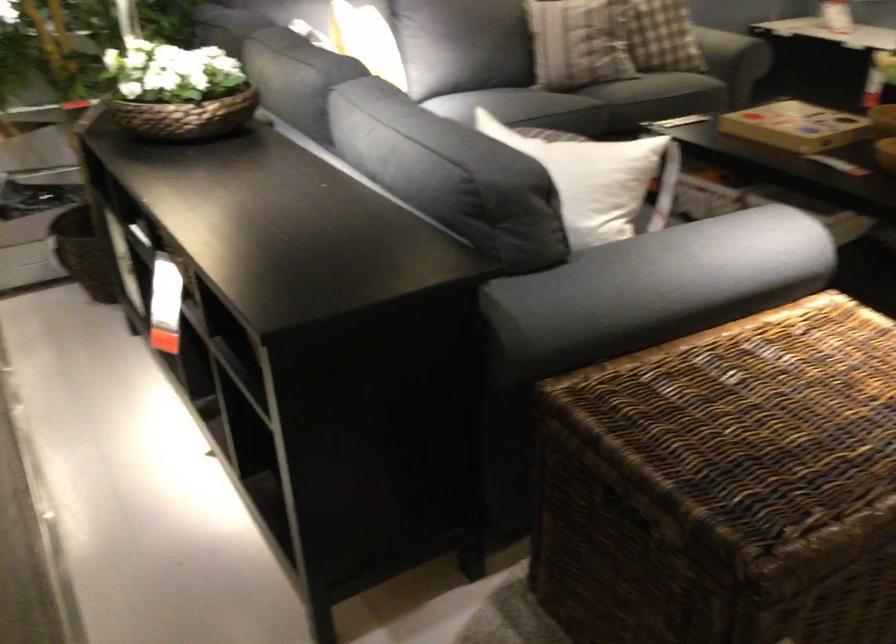
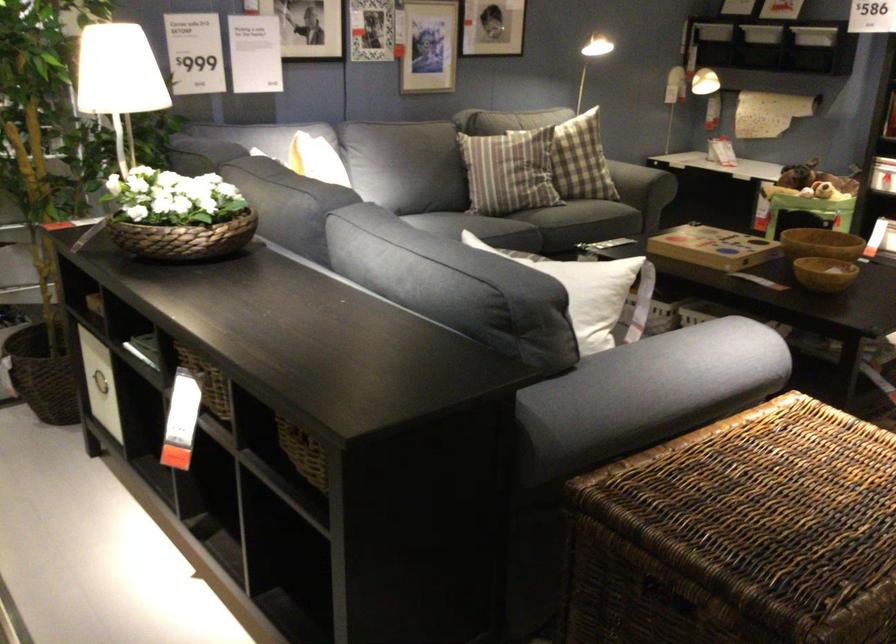
Find the pixel in the second image that matches point 122,258 in the first image.

(99, 383)